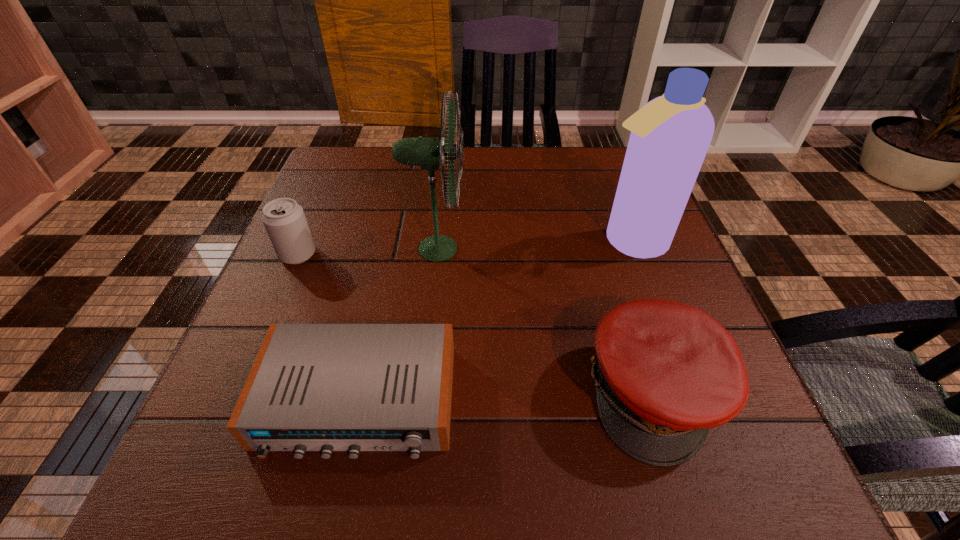
The image size is (960, 540). I want to click on object that is the fourth nearest to the shampoo, so click(284, 220).

Image resolution: width=960 pixels, height=540 pixels. Find the location of `vacant region that satisfies the following two spatial constraints: 1. on the front side of the shampoo; 2. on the front-facing side of the fan`. vacant region that satisfies the following two spatial constraints: 1. on the front side of the shampoo; 2. on the front-facing side of the fan is located at coordinates (633, 249).

This screenshot has width=960, height=540. What are the coordinates of `vacant area in the image that satisfies the following two spatial constraints: 1. on the back side of the can; 2. on the right side of the shampoo` in the screenshot? It's located at tap(303, 241).